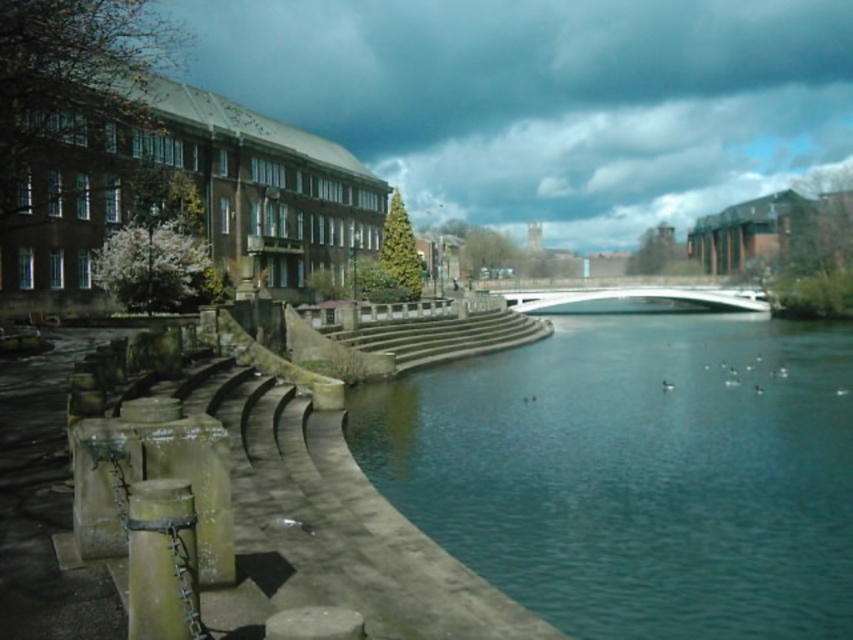
You are a delivery drone with a wingspan of 1.2 meters. You need to fly from the teal concrete river at center to the white smooth bridge at center. Is there enough space between them for your drone to pass safely?

The teal concrete river at center and white smooth bridge at center are 72.20 meters apart, so yes, the drone can safely pass between them as the distance is much greater than the drone wingspan of 1.2 meters.

You are standing on the curved walkway and want to reach the green weathered wood post at lower left. Which direction should you move relative to the teal concrete river at center?

You should move towards the lower left direction relative to the teal concrete river at center to reach the green weathered wood post at lower left, as it is positioned behind the river in the scene.

From the picture: You are standing on the curved concrete walkway and want to locate the green weathered wood post at lower left. According to the coordinates provided, where should you look relative to your position?

The green weathered wood post at lower left is located at coordinates point (x=161, y=561), which means it is positioned to the lower left relative to your current position on the walkway.